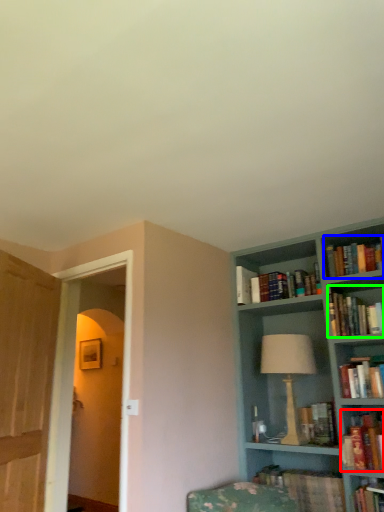
Question: Estimate the real-world distances between objects in this image. Which object is farther from book (highlighted by a red box), book (highlighted by a blue box) or book (highlighted by a green box)?

Choices:
 (A) book
 (B) book

Answer: (A)